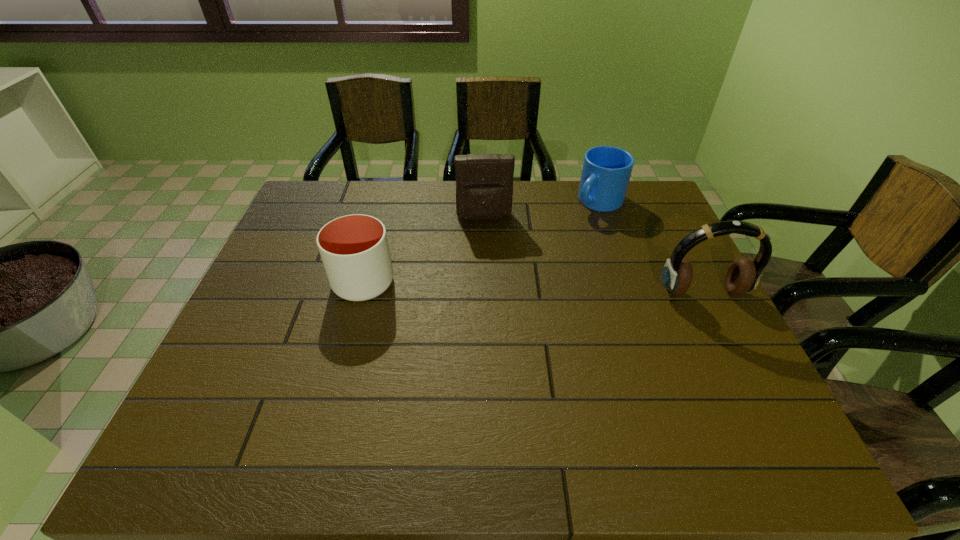
Where is `vacant space on the desktop that is between the leftmost object and the headset and is positioned on the side of the mug with the handle`? vacant space on the desktop that is between the leftmost object and the headset and is positioned on the side of the mug with the handle is located at coordinates (503, 287).

What are the coordinates of `vacant space on the desktop that is between the cup and the headset and is positioned with an open flap on the third object from right to left` in the screenshot? It's located at [492, 286].